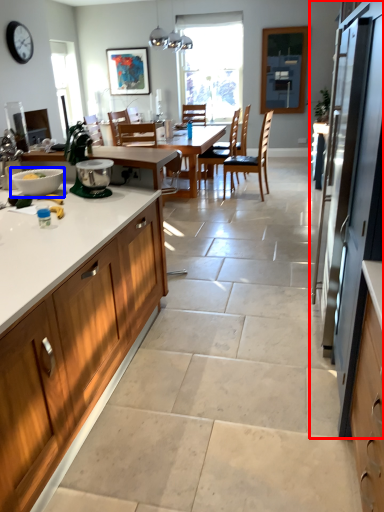
Question: Which of the following is the closest to the observer, fridge (highlighted by a red box) or bowl (highlighted by a blue box)?

Choices:
 (A) fridge
 (B) bowl

Answer: (A)